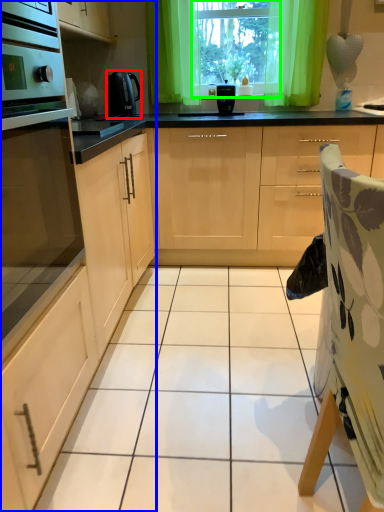
Question: Considering the real-world distances, which object is closest to kitchen appliance (highlighted by a red box)? cabinetry (highlighted by a blue box) or window screen (highlighted by a green box).

Choices:
 (A) cabinetry
 (B) window screen

Answer: (B)